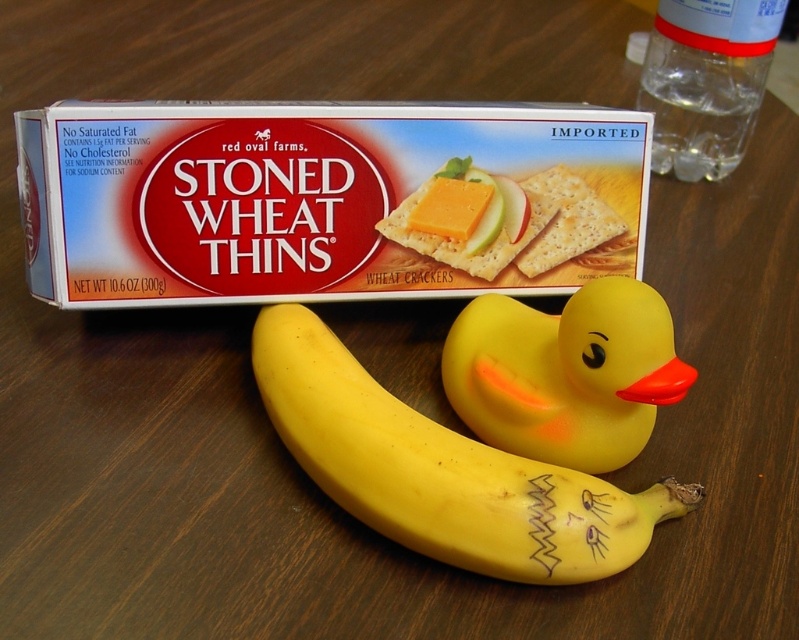
You are a child trying to reach for the yellow cheese at center on the table. There is a yellow matte banana at center in the way. Can you move the banana to get to the cheese?

The yellow matte banana at center is closer to the viewer than the yellow cheese at center, so you can move the banana to access the cheese behind it.

You are organizing a picnic basket and need to know the arrangement of items on the table. Which item is positioned lower on the table surface between the yellow matte banana at center and the yellow cheese at center?

The yellow matte banana at center is positioned below the yellow cheese at center, so it is lower on the table surface.

Based on the photo, you are organizing a picnic basket and need to know which item is taller between the yellow matte banana at center and the yellow rubber duck at center. Which one should you consider taller?

The yellow matte banana at center is taller than the yellow rubber duck at center, so you should consider the yellow matte banana at center as the taller item.